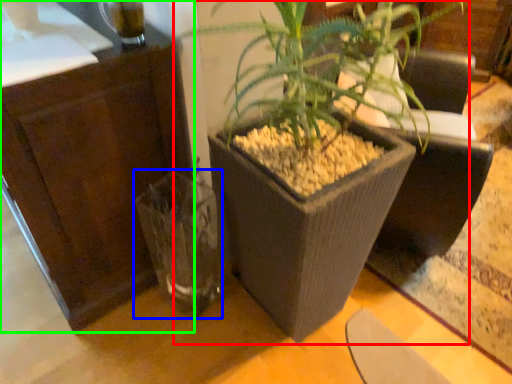
Question: Which object is positioned farthest from houseplant (highlighted by a red box)? Select from vase (highlighted by a blue box) and dresser (highlighted by a green box).

Choices:
 (A) vase
 (B) dresser

Answer: (B)